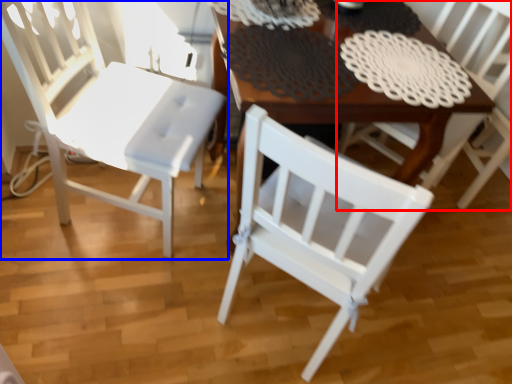
Question: Among these objects, which one is farthest to the camera, chair (highlighted by a red box) or chair (highlighted by a blue box)?

Choices:
 (A) chair
 (B) chair

Answer: (A)